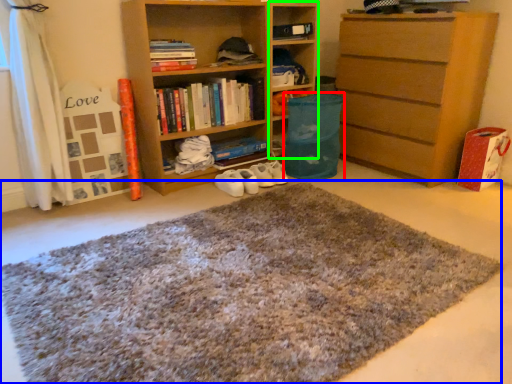
Question: Based on their relative distances, which object is farther from bean bag chair (highlighted by a red box)? Choose from doormat (highlighted by a blue box) and cabinet (highlighted by a green box).

Choices:
 (A) doormat
 (B) cabinet

Answer: (A)